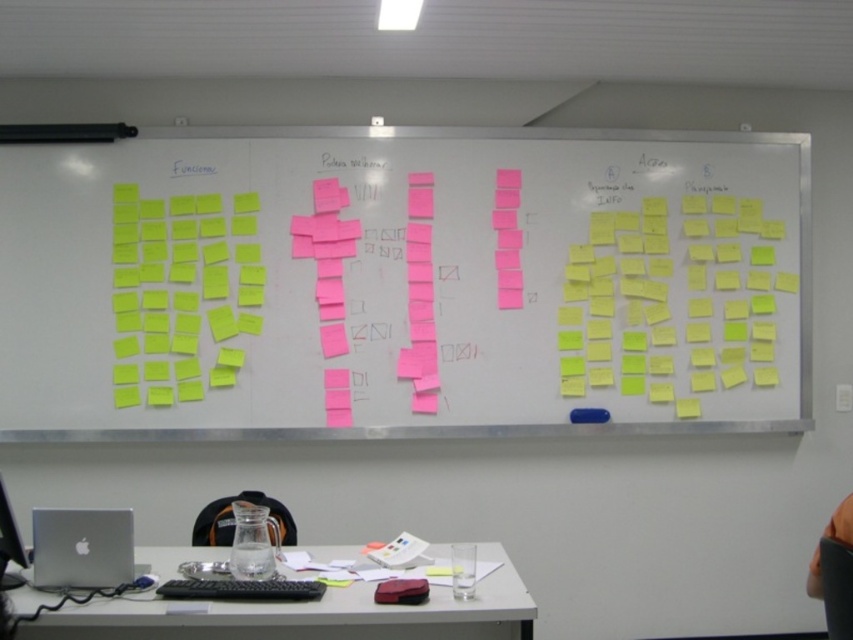
Who is higher up, silver metallic laptop at lower left or silver metallic computer at lower left?

silver metallic computer at lower left is higher up.

What do you see at coordinates (80, 547) in the screenshot?
I see `silver metallic laptop at lower left` at bounding box center [80, 547].

Does point (117, 540) come farther from viewer compared to point (0, 522)?

Yes, it is.

Find the location of a particular element. The height and width of the screenshot is (640, 853). silver metallic laptop at lower left is located at coordinates (80, 547).

Which of these two, yellow sticky notes at center or silver metallic laptop at lower left, stands shorter?

silver metallic laptop at lower left is shorter.

Is point (705, 326) farther from camera compared to point (100, 509)?

Yes, point (705, 326) is farther from viewer.

The width and height of the screenshot is (853, 640). In order to click on yellow sticky notes at center in this screenshot , I will do `click(402, 284)`.

At what (x,y) coordinates should I click in order to perform the action: click on yellow sticky notes at center. Please return your answer as a coordinate pair (x, y). Looking at the image, I should click on (402, 284).

Is yellow sticky notes at center bigger than silver metallic computer at lower left?

Yes.

Does yellow sticky notes at center have a smaller size compared to silver metallic computer at lower left?

No.

Between point (519, 362) and point (0, 586), which one is positioned in front?

Point (0, 586) is more forward.

The width and height of the screenshot is (853, 640). I want to click on yellow sticky notes at center, so click(x=402, y=284).